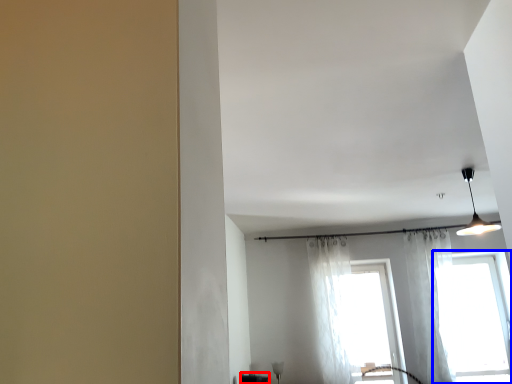
Question: Among these objects, which one is farthest to the camera, furniture (highlighted by a red box) or window (highlighted by a blue box)?

Choices:
 (A) furniture
 (B) window

Answer: (A)